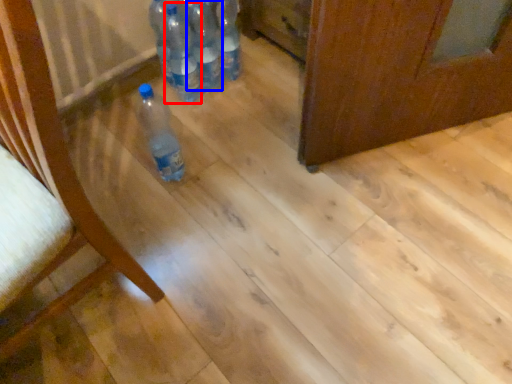
Question: Which of the following is the closest to the observer, bottle (highlighted by a red box) or bottle (highlighted by a blue box)?

Choices:
 (A) bottle
 (B) bottle

Answer: (A)